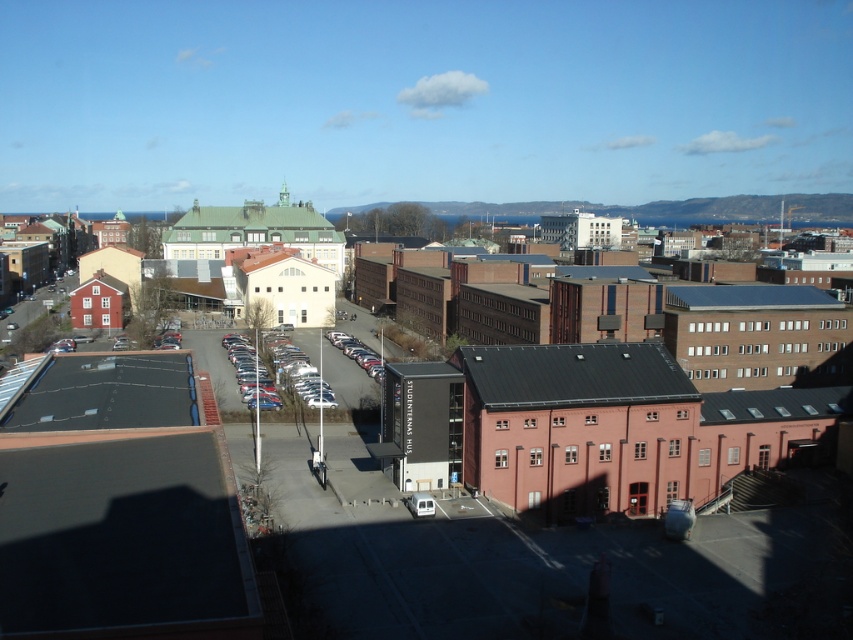
Question: Is metallic silver car at center-left to the right of metallic silver car at center from the viewer's perspective?

Choices:
 (A) no
 (B) yes

Answer: (A)

Question: Is metallic silver car at center-left behind metallic silver car at center?

Choices:
 (A) no
 (B) yes

Answer: (A)

Question: Which object appears farthest from the camera in this image?

Choices:
 (A) brick building at center
 (B) metallic silver car at center-left
 (C) metallic silver car at center

Answer: (C)

Question: Which object is farther from the camera taking this photo?

Choices:
 (A) metallic silver car at center
 (B) brick building at center

Answer: (A)

Question: Is brick building at center thinner than metallic silver car at center?

Choices:
 (A) no
 (B) yes

Answer: (A)

Question: Estimate the real-world distances between objects in this image. Which object is farther from the metallic silver car at center-left?

Choices:
 (A) brick building at center
 (B) metallic silver car at center

Answer: (A)